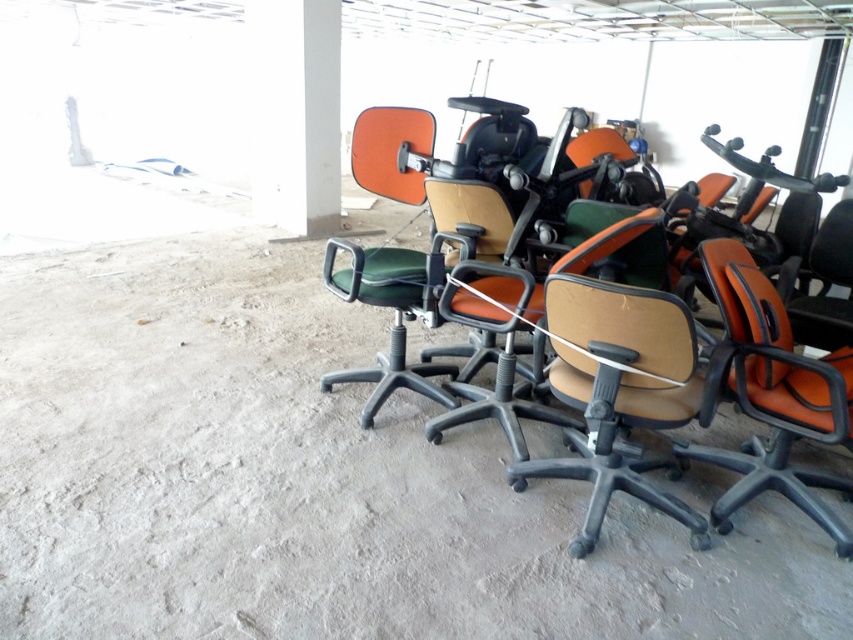
You are standing in the office area and want to locate two specific points marked in the image. Which of the two points, point 1 at coordinates point (711, 358) or point 2 at coordinates point (381, 131), is nearer to your current position?

Point 1 at coordinates point (711, 358) is closer to the camera than point 2 at coordinates point (381, 131), so point 1 at coordinates point (711, 358) is nearer to your current position.

You are standing in an office area and see the point at (x=775, y=396). What object is located at that coordinate?

The point at (x=775, y=396) indicates the orange leather swivel chair at center.

You are standing at the entrance of the construction area and want to locate the brown fabric office chair at center. According to the coordinates given, where would you find it?

The brown fabric office chair at center is located at the coordinates point (683, 376), which is near the center of the image.